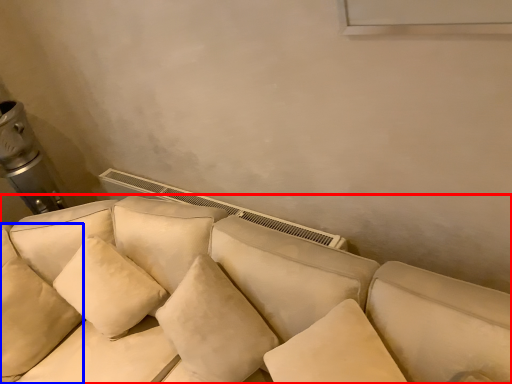
Question: Among these objects, which one is nearest to the camera, studio couch (highlighted by a red box) or pillow (highlighted by a blue box)?

Choices:
 (A) studio couch
 (B) pillow

Answer: (A)